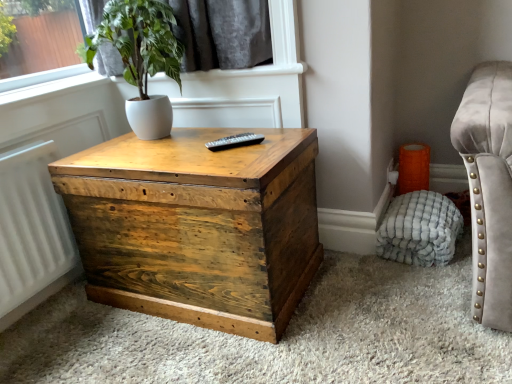
At what (x,y) coordinates should I click in order to perform the action: click on empty space that is ontop of wooden trunk at center (from a real-world perspective). Please return your answer as a coordinate pair (x, y). Looking at the image, I should click on (179, 153).